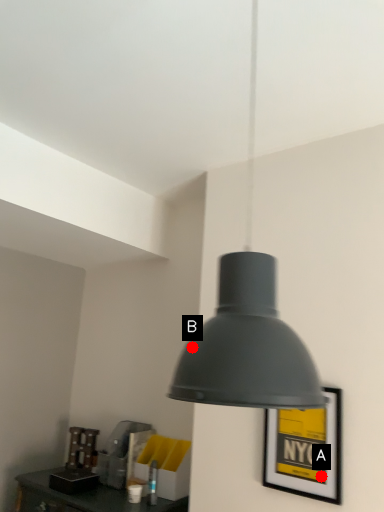
Question: Two points are circled on the image, labeled by A and B beside each circle. Which point appears farthest from the camera in this image?

Choices:
 (A) A is further
 (B) B is further

Answer: (A)